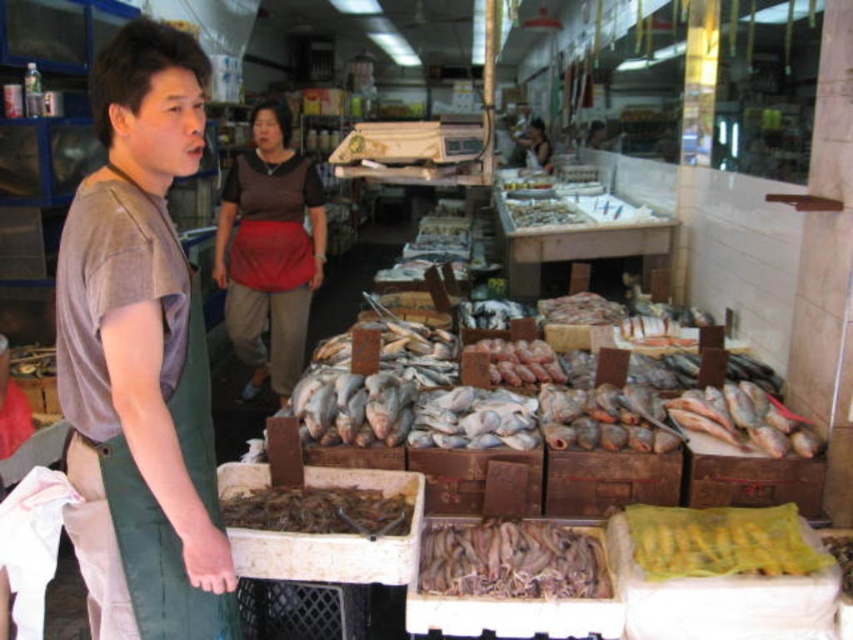
Does brown dried fish at center appear over matte brown apron at center?

Actually, brown dried fish at center is below matte brown apron at center.

Which is in front, point (259, 513) or point (548, 145)?

Point (259, 513)

Where is `brown dried fish at center`? The width and height of the screenshot is (853, 640). brown dried fish at center is located at coordinates [318, 509].

Is brownish matte fish at center closer to the viewer compared to brown dried fish at center?

No.

Which is more to the left, brownish matte fish at center or brown dried fish at center?

brown dried fish at center is more to the left.

The width and height of the screenshot is (853, 640). Find the location of `brownish matte fish at center`. brownish matte fish at center is located at coordinates (512, 561).

You are a GUI agent. You are given a task and a screenshot of the screen. Output one action in this format:
    pyautogui.click(x=<x>, y=<y>)
    Task: Click on the brownish matte fish at center
    The width and height of the screenshot is (853, 640).
    Given the screenshot: What is the action you would take?
    click(512, 561)

Between point (78, 250) and point (605, 589), which one is positioned in front?

Point (78, 250) is more forward.

Can you confirm if matte gray shirt at center is positioned above brownish matte fish at center?

Correct, matte gray shirt at center is located above brownish matte fish at center.

Who is more distant from viewer, (61, 269) or (527, 593)?

Point (527, 593)

The image size is (853, 640). Identify the location of matte gray shirt at center. (142, 352).